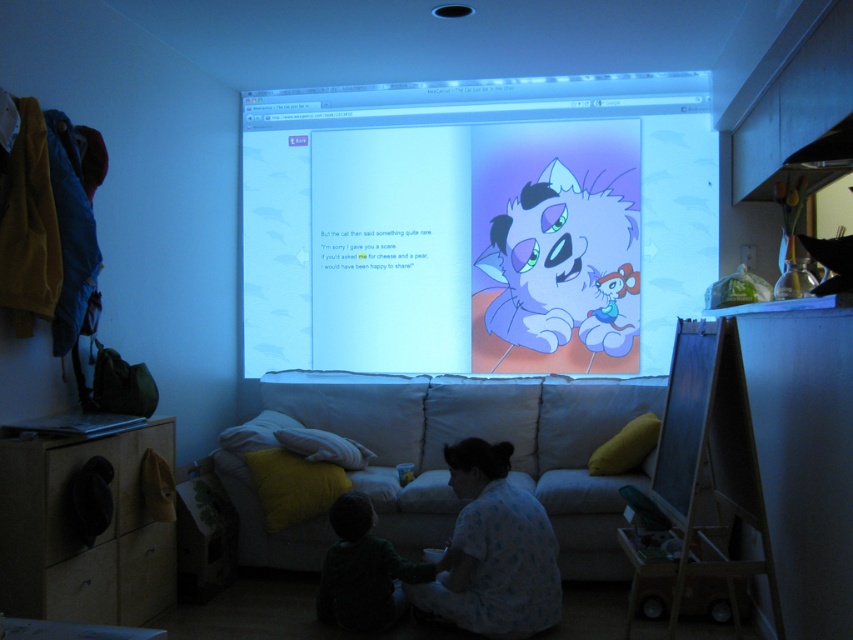
Can you confirm if white fabric couch at center is wider than black matte whiteboard at lower right?

Indeed, white fabric couch at center has a greater width compared to black matte whiteboard at lower right.

Which of these two, white fabric couch at center or black matte whiteboard at lower right, stands shorter?

Standing shorter between the two is black matte whiteboard at lower right.

Measure the distance between white fabric couch at center and camera.

white fabric couch at center is 3.59 meters from camera.

Find the location of a particular element. This screenshot has height=640, width=853. white fabric couch at center is located at coordinates (485, 438).

Does white fabric couch at center lie in front of light blue cotton pajamas at lower center?

→ No, it is behind light blue cotton pajamas at lower center.

Does white fabric couch at center have a lesser height compared to light blue cotton pajamas at lower center?

No.

Where is `white fabric couch at center`? This screenshot has width=853, height=640. white fabric couch at center is located at coordinates (485, 438).

Is light blue cotton pajamas at lower center wider than black matte whiteboard at lower right?

Indeed, light blue cotton pajamas at lower center has a greater width compared to black matte whiteboard at lower right.

Does light blue cotton pajamas at lower center appear on the left side of black matte whiteboard at lower right?

Correct, you'll find light blue cotton pajamas at lower center to the left of black matte whiteboard at lower right.

This screenshot has height=640, width=853. In order to click on light blue cotton pajamas at lower center in this screenshot , I will do `click(492, 552)`.